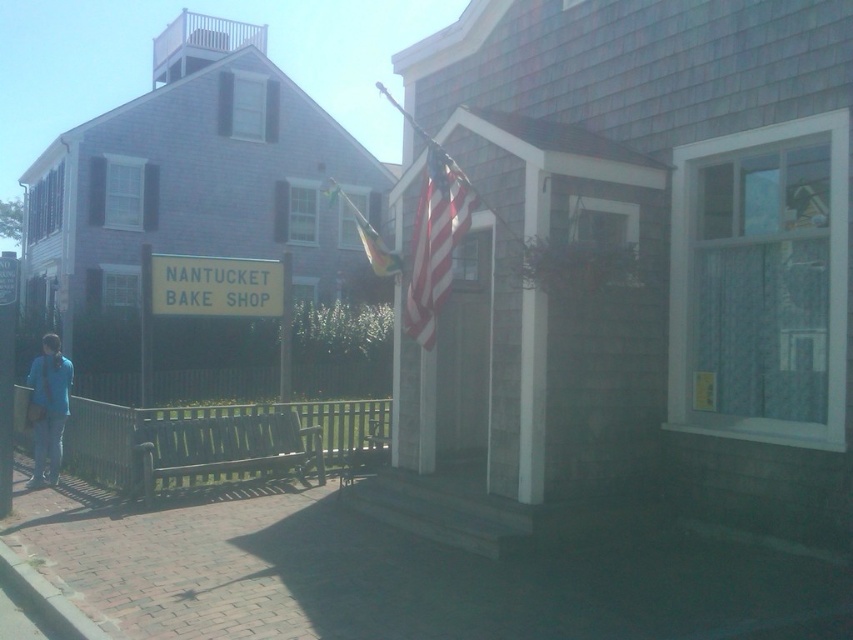
Which is more to the right, brick pavement at lower left or american flag at center?

american flag at center is more to the right.

Is brick pavement at lower left wider than american flag at center?

Correct, the width of brick pavement at lower left exceeds that of american flag at center.

Who is more forward, (155, 625) or (444, 180)?

Positioned in front is point (155, 625).

Identify the location of brick pavement at lower left. (405, 577).

Describe the element at coordinates (434, 243) in the screenshot. The height and width of the screenshot is (640, 853). I see `american flag at center` at that location.

Does point (440, 177) come in front of point (51, 433)?

Yes, it is in front of point (51, 433).

Is point (450, 218) farther from viewer compared to point (61, 353)?

That is False.

The height and width of the screenshot is (640, 853). In order to click on american flag at center in this screenshot , I will do `click(434, 243)`.

This screenshot has height=640, width=853. Describe the element at coordinates (405, 577) in the screenshot. I see `brick pavement at lower left` at that location.

Is brick pavement at lower left bigger than blue fabric bag at lower left?

Indeed, brick pavement at lower left has a larger size compared to blue fabric bag at lower left.

Image resolution: width=853 pixels, height=640 pixels. Find the location of `brick pavement at lower left`. brick pavement at lower left is located at coordinates (405, 577).